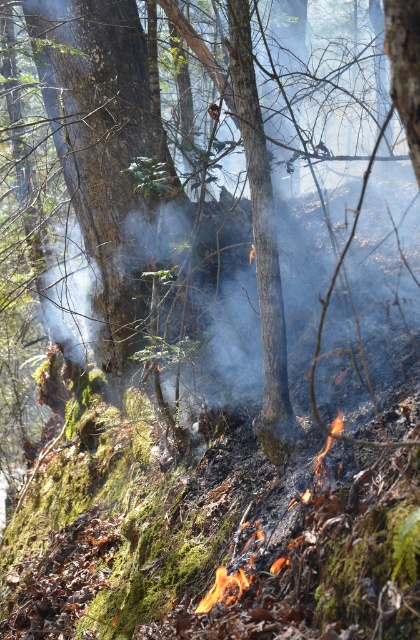
Between green mossy tree at center and flaming charred debris at lower center, which one is positioned lower?

flaming charred debris at lower center is lower down.

Who is more distant from viewer, (88, 221) or (220, 573)?

Point (88, 221)

Is point (78, 80) farther from viewer compared to point (196, 611)?

Yes, it is.

I want to click on green mossy tree at center, so click(99, 132).